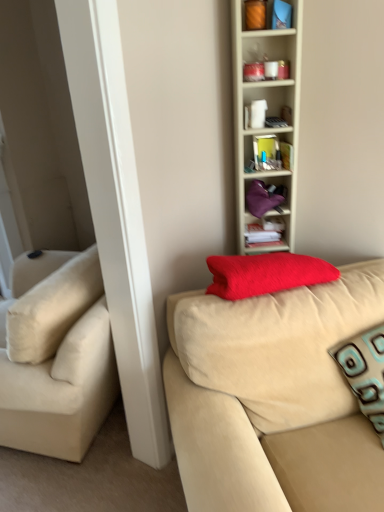
Question: Is velvet beige couch at center a part of teal patterned pillow at right?

Choices:
 (A) yes
 (B) no

Answer: (B)

Question: Does teal patterned pillow at right have a greater height compared to velvet beige couch at center?

Choices:
 (A) no
 (B) yes

Answer: (A)

Question: Is teal patterned pillow at right bigger than velvet beige couch at center?

Choices:
 (A) yes
 (B) no

Answer: (B)

Question: Is teal patterned pillow at right positioned far away from velvet beige couch at center?

Choices:
 (A) no
 (B) yes

Answer: (A)

Question: Is teal patterned pillow at right oriented away from velvet beige couch at center?

Choices:
 (A) no
 (B) yes

Answer: (B)

Question: From the image's perspective, would you say teal patterned pillow at right is positioned over velvet beige couch at center?

Choices:
 (A) no
 (B) yes

Answer: (B)

Question: Does velvet beige couch at center appear on the left side of white paper stack at upper center?

Choices:
 (A) no
 (B) yes

Answer: (A)

Question: From a real-world perspective, is velvet beige couch at center physically above white paper stack at upper center?

Choices:
 (A) yes
 (B) no

Answer: (B)

Question: Is velvet beige couch at center turned away from white paper stack at upper center?

Choices:
 (A) yes
 (B) no

Answer: (A)

Question: Can you confirm if velvet beige couch at center is positioned to the right of white paper stack at upper center?

Choices:
 (A) no
 (B) yes

Answer: (B)

Question: Can you confirm if velvet beige couch at center is bigger than white paper stack at upper center?

Choices:
 (A) yes
 (B) no

Answer: (A)

Question: Is velvet beige couch at center not inside white paper stack at upper center?

Choices:
 (A) no
 (B) yes

Answer: (B)

Question: Does orange matte candle at upper center, acting as the first cabinet starting from the top, turn towards teal patterned pillow at right?

Choices:
 (A) yes
 (B) no

Answer: (B)